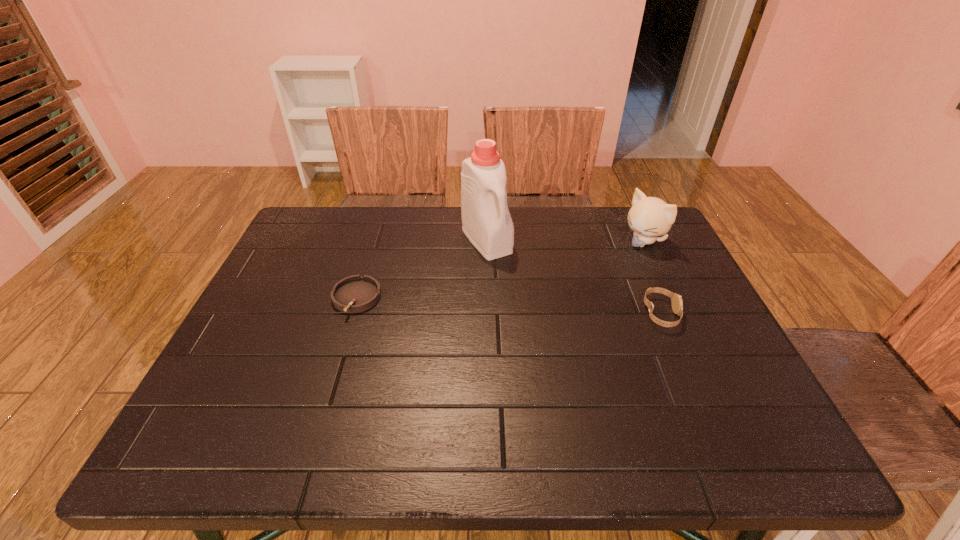
Identify the location of vacant space at the near edge. This screenshot has width=960, height=540. (427, 381).

I want to click on free location at the left edge of the desktop, so click(x=284, y=373).

Find the location of `free location at the right edge`. free location at the right edge is located at coordinates (720, 347).

This screenshot has height=540, width=960. Find the location of `free space at the far left corner of the desktop`. free space at the far left corner of the desktop is located at coordinates pyautogui.click(x=333, y=246).

Locate an element on the screen. The image size is (960, 540). free space at the near left corner of the desktop is located at coordinates 271,399.

The height and width of the screenshot is (540, 960). I want to click on vacant area that lies between the third shortest object and the ashtray, so click(499, 270).

Locate an element on the screen. empty space that is in between the shortest object and the tallest object is located at coordinates (x=421, y=269).

This screenshot has height=540, width=960. Identify the location of free space that is in between the ashtray and the watch. (509, 306).

Where is `free point between the third shortest object and the third tallest object`? This screenshot has width=960, height=540. free point between the third shortest object and the third tallest object is located at coordinates (652, 278).

The image size is (960, 540). In order to click on empty location between the watch and the detergent in this screenshot , I will do `click(574, 277)`.